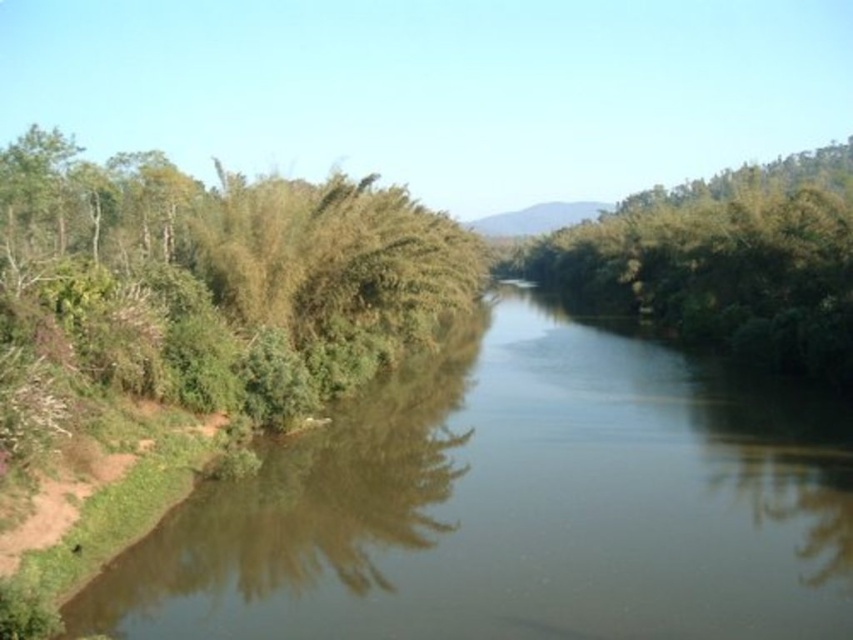
Question: Which object appears closest to the camera in this image?

Choices:
 (A) green leafy trees at center
 (B) green leafy river at left

Answer: (B)

Question: Can you confirm if green leafy river at left is positioned below green leafy trees at center?

Choices:
 (A) no
 (B) yes

Answer: (B)

Question: Which object is closer to the camera taking this photo?

Choices:
 (A) green leafy trees at center
 (B) green leafy river at left

Answer: (B)

Question: Is green leafy river at left behind green leafy trees at center?

Choices:
 (A) yes
 (B) no

Answer: (B)

Question: Is green leafy river at left below green leafy trees at center?

Choices:
 (A) yes
 (B) no

Answer: (A)